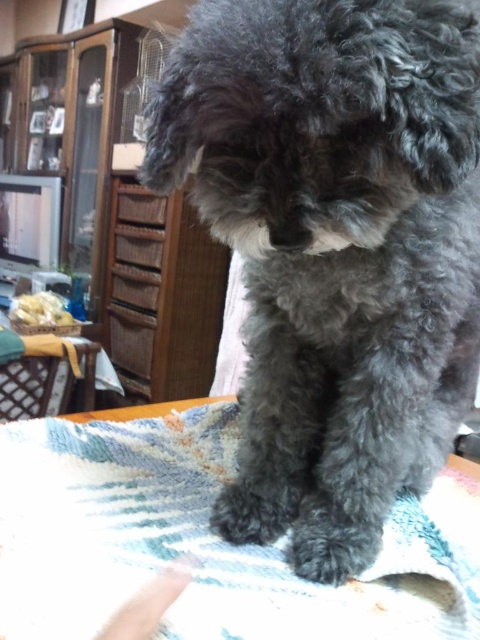
You are a dog owner who wants to ensure your pet stays dry. The dark gray fur at center is currently damp. Based on the scene, where should you place the dog to keep it away from the wooden dresser at upper left and ensure it stays dry?

The dark gray fur at center should be moved away from the wooden dresser at upper left since the wooden dresser at upper left is taller than the dark gray fur at center, which means water could drip down from the dresser onto the dog.

You are a pet sitter who needs to cover the dark gray fur at center with the blue textured blanket at lower center. Based on their sizes, will the blanket be sufficient to cover the dog?

The dark gray fur at center is larger in size than blue textured blanket at lower center, so the blanket will not be sufficient to cover the dog.